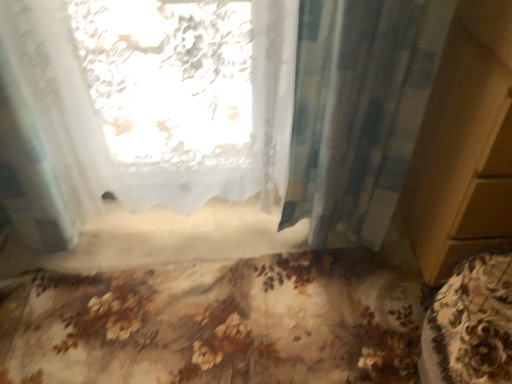
The width and height of the screenshot is (512, 384). Describe the element at coordinates (217, 323) in the screenshot. I see `fluffy carpet at lower center` at that location.

This screenshot has height=384, width=512. I want to click on fluffy carpet at lower center, so click(217, 323).

Locate an element on the screen. fluffy carpet at lower center is located at coordinates (217, 323).